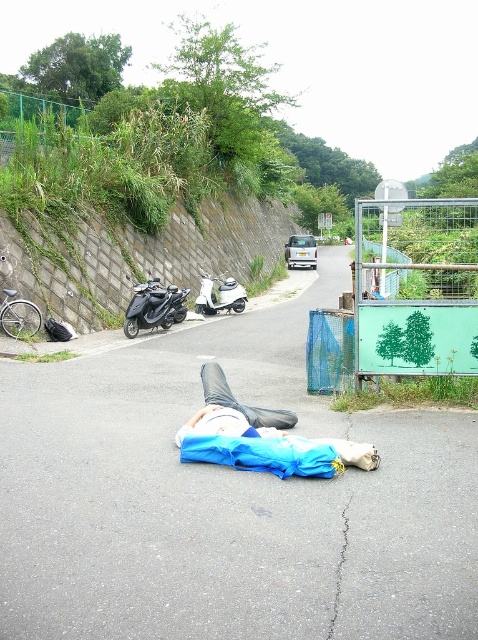
Can you confirm if blue fabric at center is thinner than shiny black scooter at left?

No, blue fabric at center is not thinner than shiny black scooter at left.

Where is `blue fabric at center`? blue fabric at center is located at coordinates (260, 436).

Where is `blue fabric at center`? The image size is (478, 640). blue fabric at center is located at coordinates (260, 436).

Is shiny black scooter at left wider than white glossy scooter at center?

Incorrect, shiny black scooter at left's width does not surpass white glossy scooter at center's.

From the picture: Is shiny black scooter at left smaller than white glossy scooter at center?

No, shiny black scooter at left is not smaller than white glossy scooter at center.

This screenshot has width=478, height=640. Find the location of `shiny black scooter at left`. shiny black scooter at left is located at coordinates (153, 307).

Where is `shiny black scooter at left`? shiny black scooter at left is located at coordinates (153, 307).

Is blue fabric at center shorter than white glossy scooter at center?

Yes, blue fabric at center is shorter than white glossy scooter at center.

Can you confirm if blue fabric at center is positioned below white glossy scooter at center?

Correct, blue fabric at center is located below white glossy scooter at center.

At what (x,y) coordinates should I click in order to perform the action: click on blue fabric at center. Please return your answer as a coordinate pair (x, y). Looking at the image, I should click on (260, 436).

Where is `blue fabric at center`? The image size is (478, 640). blue fabric at center is located at coordinates (260, 436).